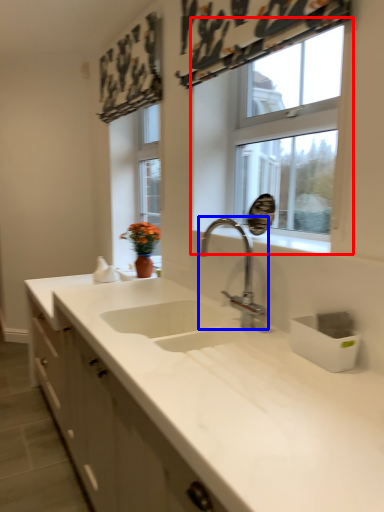
Question: Which point is closer to the camera, window (highlighted by a red box) or tap (highlighted by a blue box)?

Choices:
 (A) window
 (B) tap

Answer: (B)